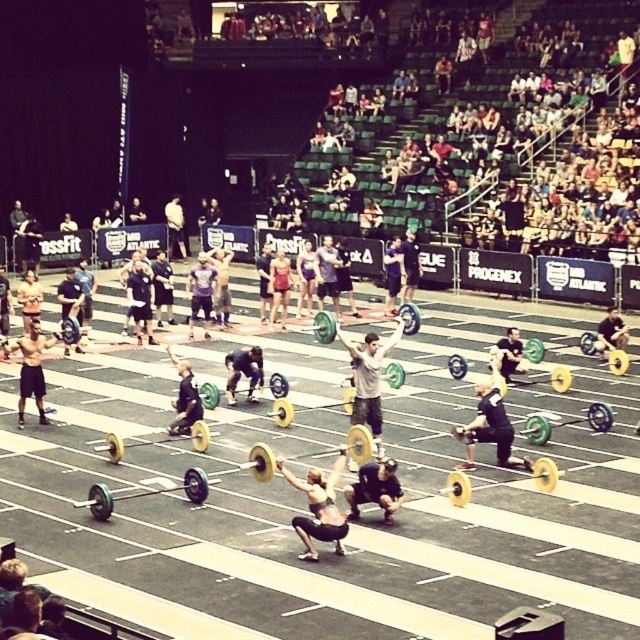
Question: Which is nearer to the matte black tank top at center?

Choices:
 (A) yellow rubber barbell at center
 (B) gold/yellow weight at center

Answer: (A)

Question: Which object is positioned farthest from the matte black tank top at center?

Choices:
 (A) matte pink shorts at center
 (B) shiny black barbell at center
 (C) shiny black shorts at center

Answer: (A)

Question: Can you confirm if matte black tank top at center is bigger than shiny black shorts at center?

Choices:
 (A) yes
 (B) no

Answer: (A)

Question: Which object is farther from the camera taking this photo?

Choices:
 (A) shiny black barbell at center
 (B) matte black tank top at center

Answer: (A)

Question: Can you confirm if matte black tank top at center is positioned above shiny black shorts at center?

Choices:
 (A) yes
 (B) no

Answer: (B)

Question: Is black rubber squat at center above gold/yellow weight at center?

Choices:
 (A) yes
 (B) no

Answer: (B)